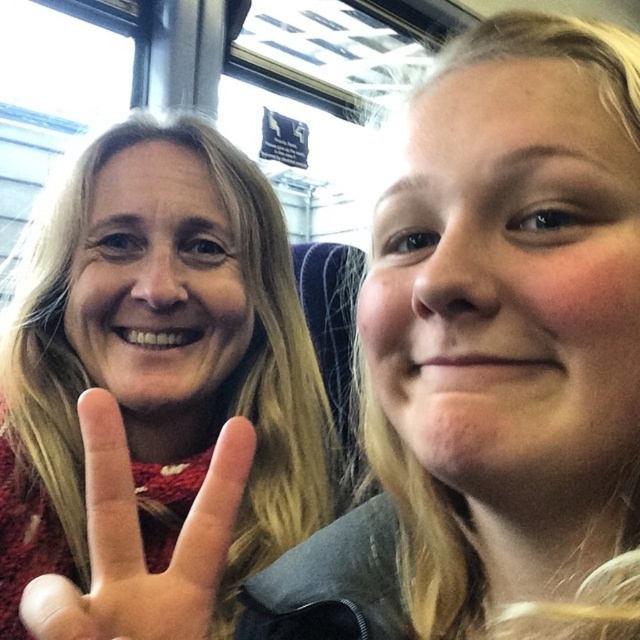
You are an interior designer assessing the seating arrangement in a public transport vehicle. You notice the matte red sweater at left and the matte red sweater at lower left. Which sweater is placed lower in the seating area?

The matte red sweater at left is positioned under the matte red sweater at lower left, meaning it is placed lower in the seating area.